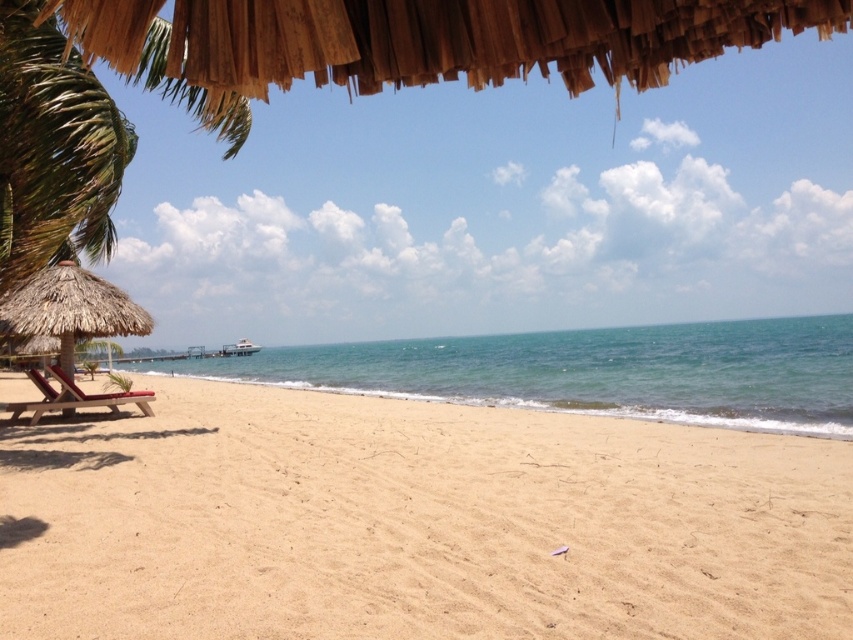
Between point (141, 307) and point (71, 397), which one is positioned behind?

The point (141, 307) is behind.

In the scene shown: Is thatched straw umbrella at left above matte brown lounge chair at lower left?

Correct, thatched straw umbrella at left is located above matte brown lounge chair at lower left.

Which is in front, point (57, 314) or point (152, 392)?

Point (57, 314) is in front.

What are the coordinates of `thatched straw umbrella at left` in the screenshot? It's located at 71,308.

Who is taller, light beige sand at center or thatched straw umbrella at left?

With more height is thatched straw umbrella at left.

Is light beige sand at center to the left of thatched straw umbrella at left from the viewer's perspective?

In fact, light beige sand at center is to the right of thatched straw umbrella at left.

This screenshot has width=853, height=640. What do you see at coordinates (415, 524) in the screenshot?
I see `light beige sand at center` at bounding box center [415, 524].

Find the location of `light beige sand at center`. light beige sand at center is located at coordinates (415, 524).

Can you confirm if light beige sand at center is wider than green leafy palm tree at left?

Yes, light beige sand at center is wider than green leafy palm tree at left.

The width and height of the screenshot is (853, 640). What do you see at coordinates (415, 524) in the screenshot? I see `light beige sand at center` at bounding box center [415, 524].

Image resolution: width=853 pixels, height=640 pixels. Identify the location of light beige sand at center. (415, 524).